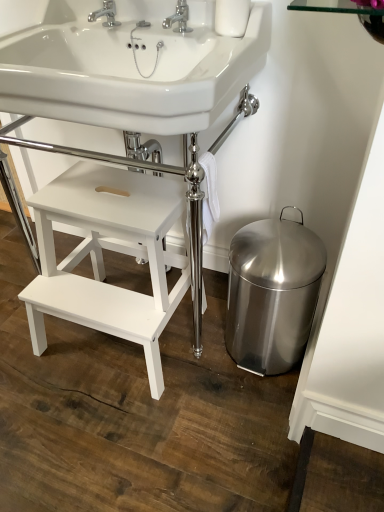
Find the location of a particular element. The width and height of the screenshot is (384, 512). free space above white matte stool at lower left (from a real-world perspective) is located at coordinates (103, 194).